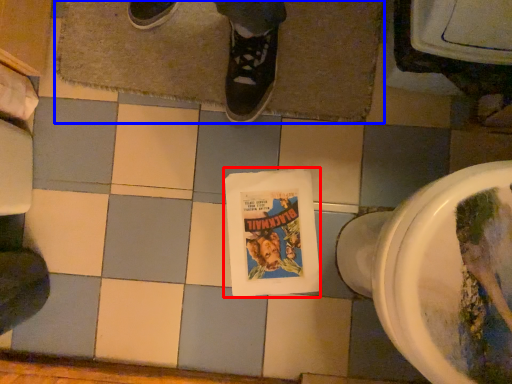
Question: Among these objects, which one is nearest to the camera, comic book (highlighted by a red box) or bath mat (highlighted by a blue box)?

Choices:
 (A) comic book
 (B) bath mat

Answer: (B)